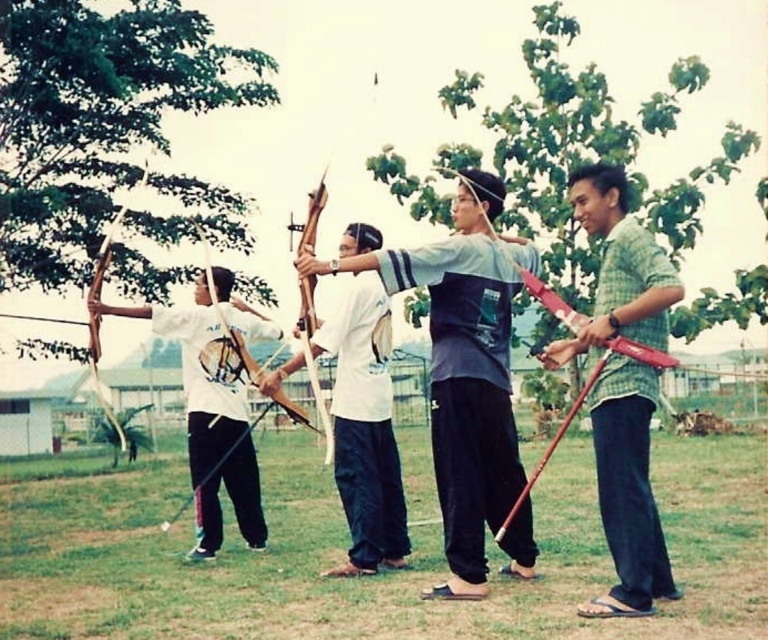
You are an archer standing in the field and see the matte gray shirt at center and the matte wood bow at center. Which object is larger in size?

The matte wood bow at center is larger than the matte gray shirt at center according to the description.

You are an archer standing in the field and want to grab the closest bow to you. Which bow should you choose between the matte wood bow at center and the wooden bow at left?

The matte wood bow at center is closer to the viewer than the wooden bow at left, so you should choose the matte wood bow at center.

You are an archer standing in the field and see the matte wood bow at center and the wooden bow at left. Which bow is positioned higher in the image?

The matte wood bow at center is positioned higher than the wooden bow at left.